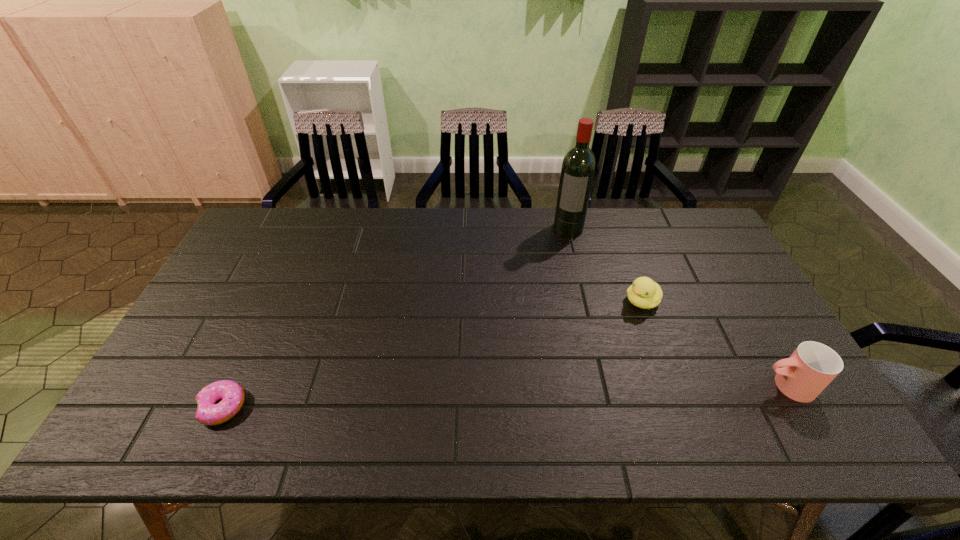
Where is `free space at the near left corner of the desktop`? The image size is (960, 540). free space at the near left corner of the desktop is located at coordinates (186, 402).

Find the location of a particular element. The height and width of the screenshot is (540, 960). free region at the far right corner of the desktop is located at coordinates (676, 242).

At what (x,y) coordinates should I click in order to perform the action: click on vacant area that lies between the rightmost object and the third nearest object. Please return your answer as a coordinate pair (x, y). Looking at the image, I should click on (714, 343).

Locate an element on the screen. vacant space that is in between the tallest object and the doughnut is located at coordinates (396, 318).

At what (x,y) coordinates should I click in order to perform the action: click on free point between the shortest object and the farthest object. Please return your answer as a coordinate pair (x, y). The height and width of the screenshot is (540, 960). Looking at the image, I should click on (396, 318).

Identify the location of vacant area that lies between the tallest object and the rightmost object. Image resolution: width=960 pixels, height=540 pixels. (678, 307).

Locate an element on the screen. This screenshot has width=960, height=540. vacant space that's between the third object from right to left and the second object from right to left is located at coordinates (606, 265).

Locate an element on the screen. free spot between the third nearest object and the third shortest object is located at coordinates (714, 343).

Find the location of a particular element. This screenshot has width=960, height=540. unoccupied position between the rightmost object and the second object from right to left is located at coordinates (714, 343).

Image resolution: width=960 pixels, height=540 pixels. In order to click on free space between the wine bottle and the shortest object in this screenshot , I will do click(396, 318).